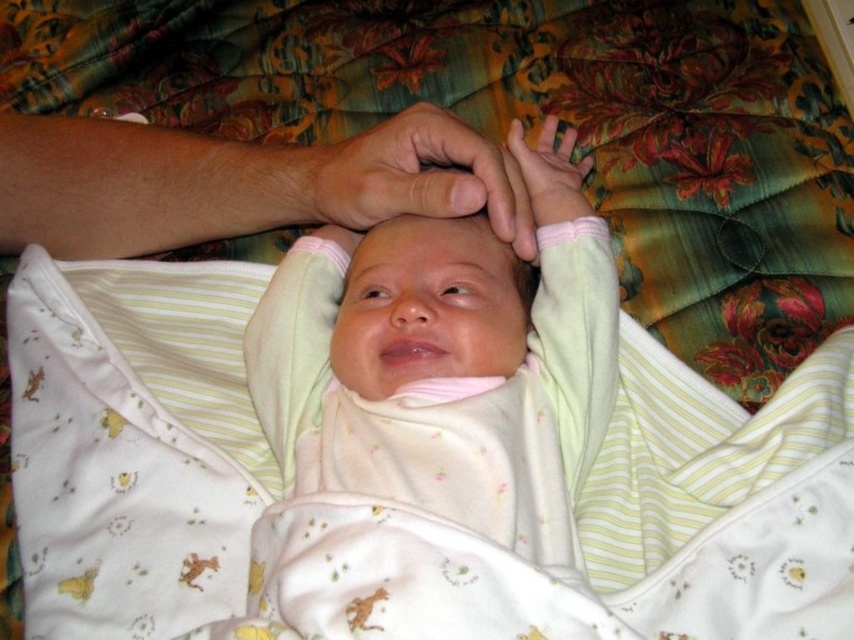
Who is shorter, smooth skin hand at upper center or smooth skin hand at center?

Standing shorter between the two is smooth skin hand at center.

Is smooth skin hand at upper center smaller than smooth skin hand at center?

No.

Between point (51, 129) and point (364, 132), which one is positioned in front?

Point (364, 132) is in front.

Where is `smooth skin hand at upper center`? This screenshot has height=640, width=854. smooth skin hand at upper center is located at coordinates (x=240, y=182).

Can you confirm if smooth skin hand at upper center is bigger than pink fabric at center?

Correct, smooth skin hand at upper center is larger in size than pink fabric at center.

Is smooth skin hand at upper center shorter than pink fabric at center?

In fact, smooth skin hand at upper center may be taller than pink fabric at center.

Which is in front, point (59, 192) or point (559, 166)?

Point (559, 166)

The height and width of the screenshot is (640, 854). I want to click on smooth skin hand at upper center, so click(240, 182).

Which of these two, soft yellow fabric swaddle at center or smooth skin hand at upper center, stands taller?

soft yellow fabric swaddle at center

Between point (434, 243) and point (211, 154), which one is positioned in front?

Positioned in front is point (434, 243).

I want to click on soft yellow fabric swaddle at center, so click(x=420, y=413).